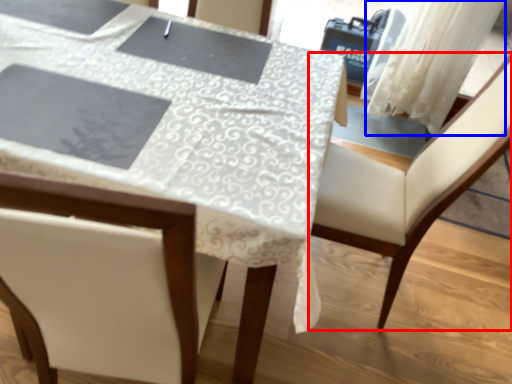
Question: Among these objects, which one is nearest to the camera, chair (highlighted by a red box) or curtain (highlighted by a blue box)?

Choices:
 (A) chair
 (B) curtain

Answer: (A)